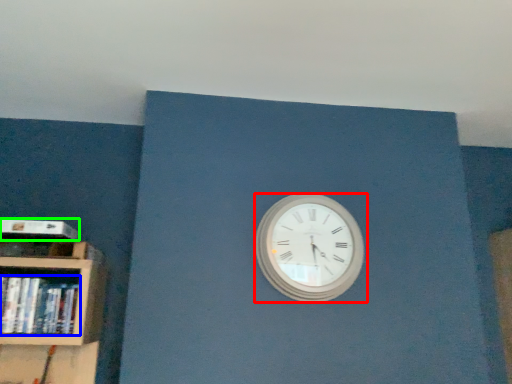
Question: Which object is the farthest from wall clock (highlighted by a red box)? Choose among these: book (highlighted by a blue box) or paperback book (highlighted by a green box).

Choices:
 (A) book
 (B) paperback book

Answer: (B)